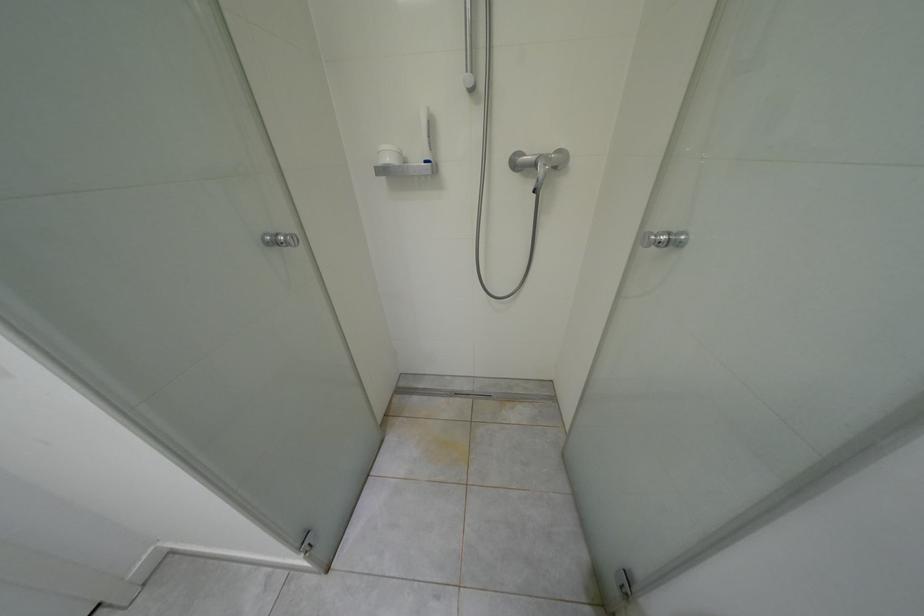
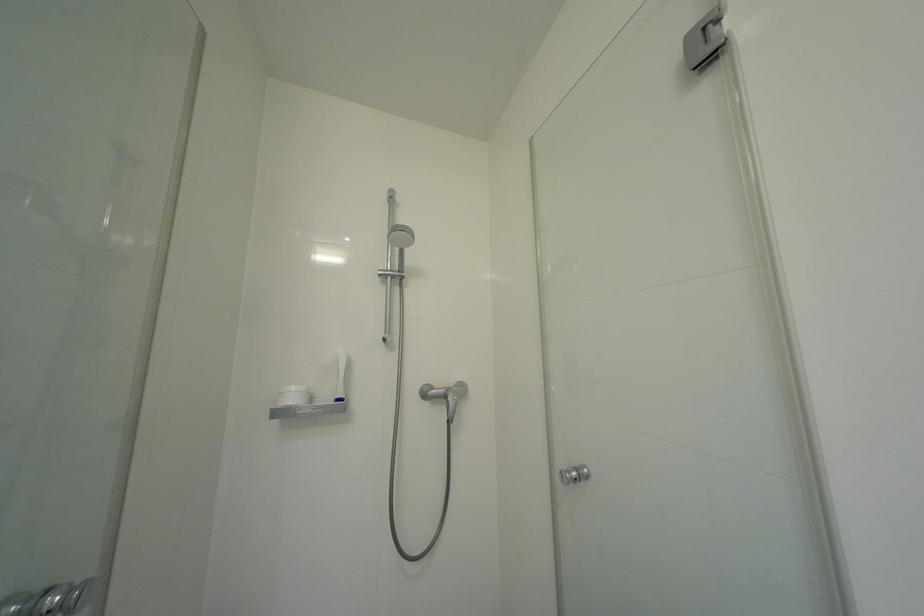
The images are taken continuously from a first-person perspective. In which direction is your viewpoint rotating?

The camera's rotation is toward right-up.